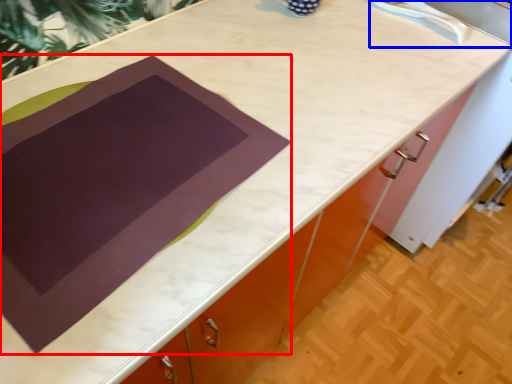
Question: Among these objects, which one is farthest to the camera, blanket (highlighted by a red box) or sink (highlighted by a blue box)?

Choices:
 (A) blanket
 (B) sink

Answer: (B)